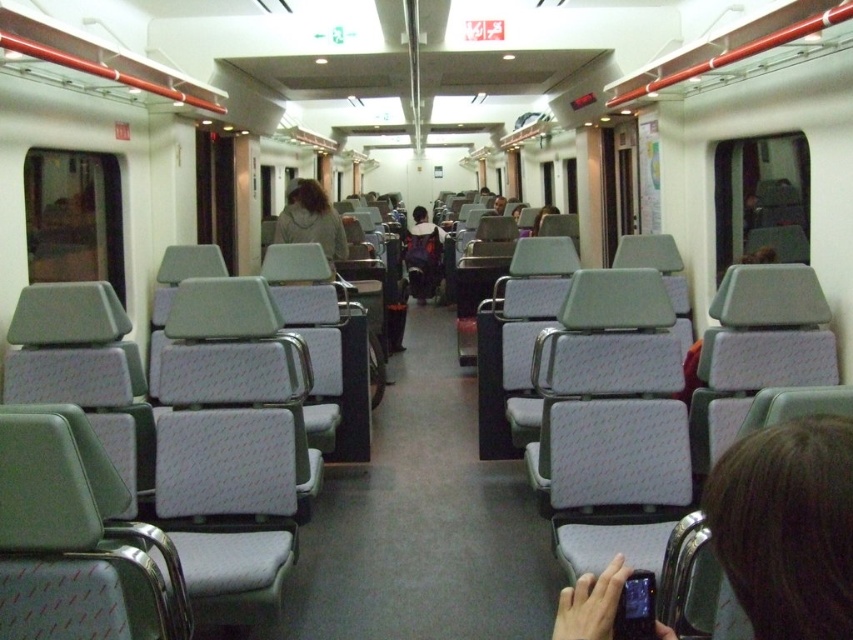
You are a passenger in the train carriage and need to retrieve your dark gray fabric backpack at center. To do so, you must first move from your current seat to the area near the matte gray seat at right. How should you navigate the seating arrangement to reach your backpack?

The dark gray fabric backpack at center is located above the matte gray seat at right, so you should move to the area near the matte gray seat at right and look above it to retrieve your backpack.

You are a passenger sitting in the train carriage described. You notice a light gray fabric jacket at center. Can you confirm if this jacket is placed exactly at the coordinates point (311, 220)?

Yes, the light gray fabric jacket at center is located exactly at point (311, 220).